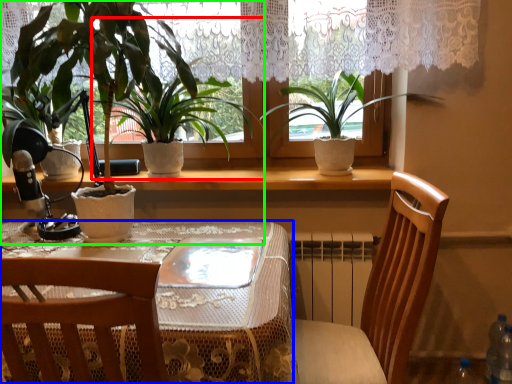
Question: Which object is positioned closest to houseplant (highlighted by a red box)? Select from table (highlighted by a blue box) and houseplant (highlighted by a green box).

Choices:
 (A) table
 (B) houseplant

Answer: (B)